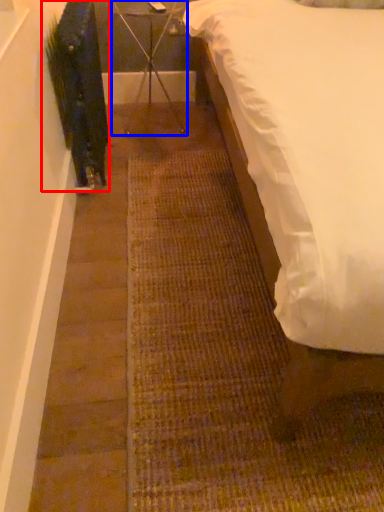
Question: Which object appears closest to the camera in this image, plant (highlighted by a red box) or furniture (highlighted by a blue box)?

Choices:
 (A) plant
 (B) furniture

Answer: (A)